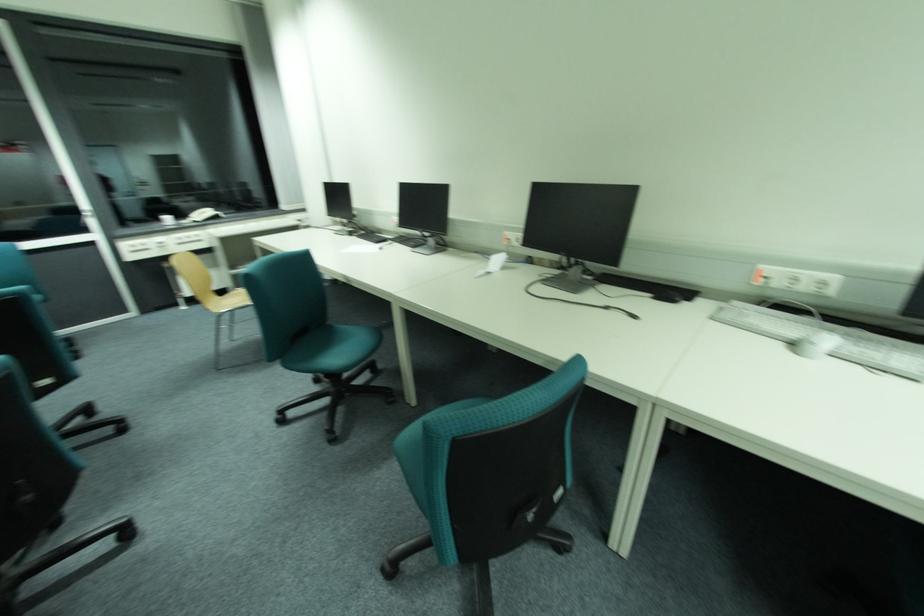
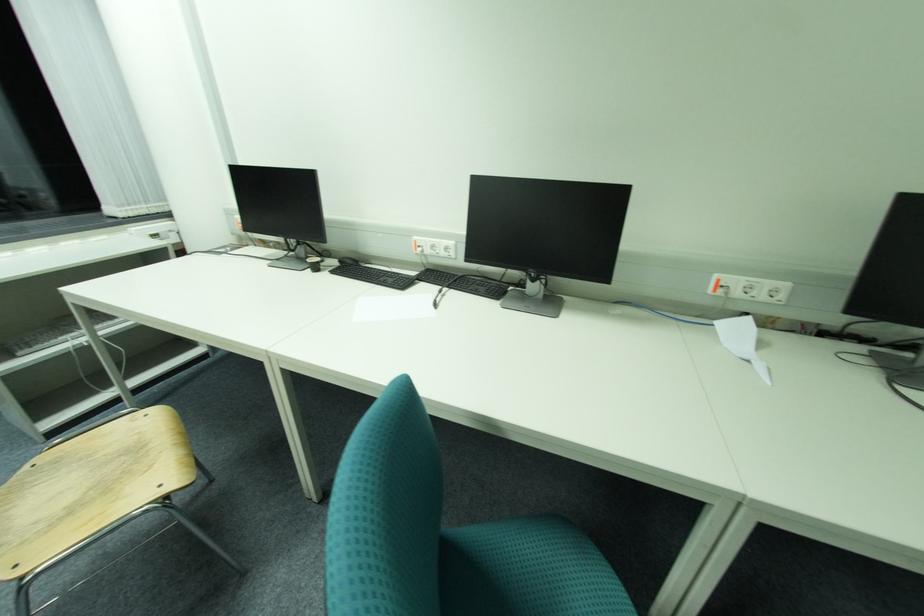
In a continuous first-person perspective shot, in which direction is the camera moving?

The cameraman moved toward left, forward.